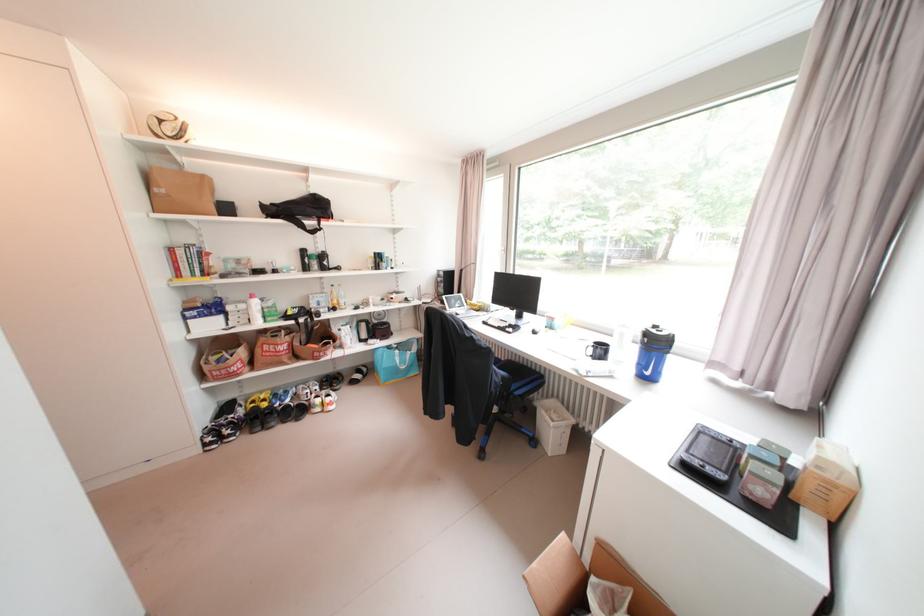
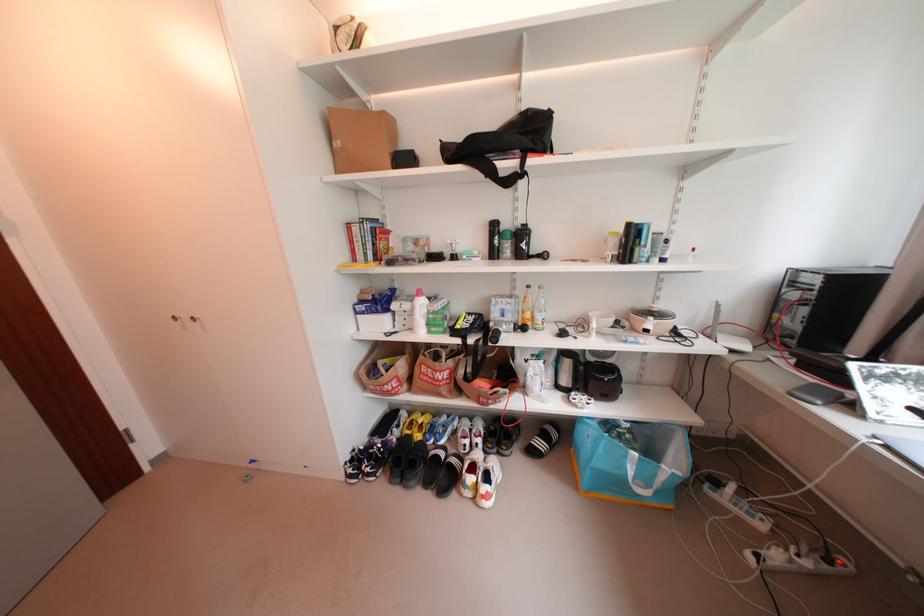
In the second image, find the point that corresponds to the point at 335,400 in the first image.

(492, 488)